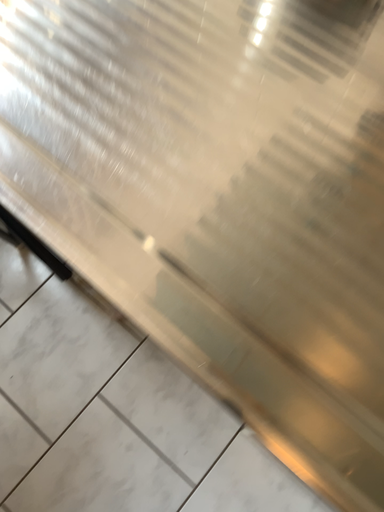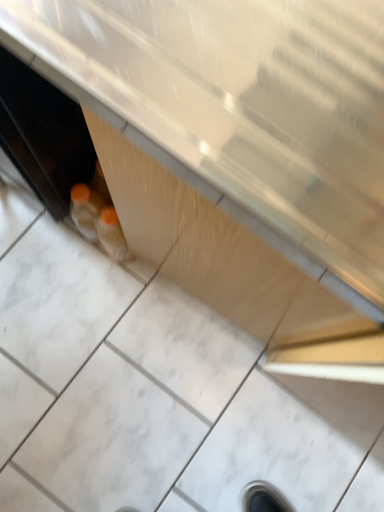
Question: Which way did the camera rotate in the video?

Choices:
 (A) rotated left
 (B) rotated right

Answer: (B)